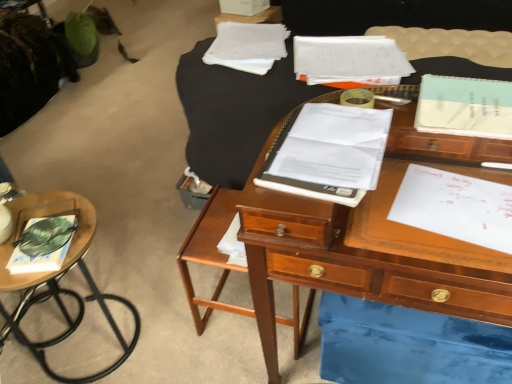
Identify the location of empty space that is ontop of wooden side table at lower left, positioned as the first table in left-to-right order (from a real-world perspective). point(49,233).